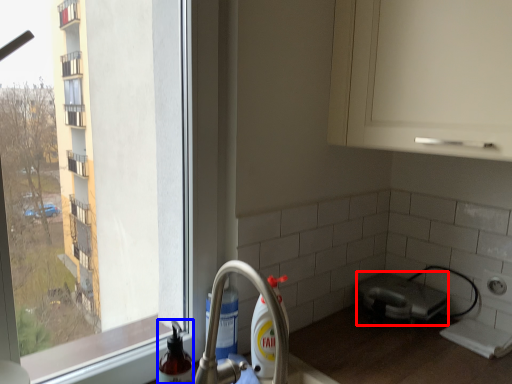
Question: Which point is closer to the camera, appliance (highlighted by a red box) or cleaning product (highlighted by a blue box)?

Choices:
 (A) appliance
 (B) cleaning product

Answer: (B)